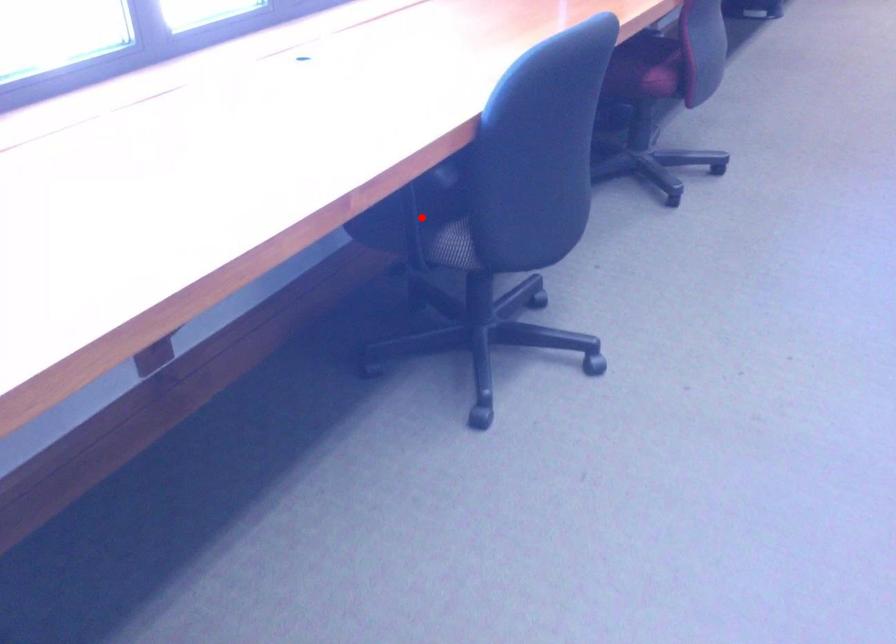
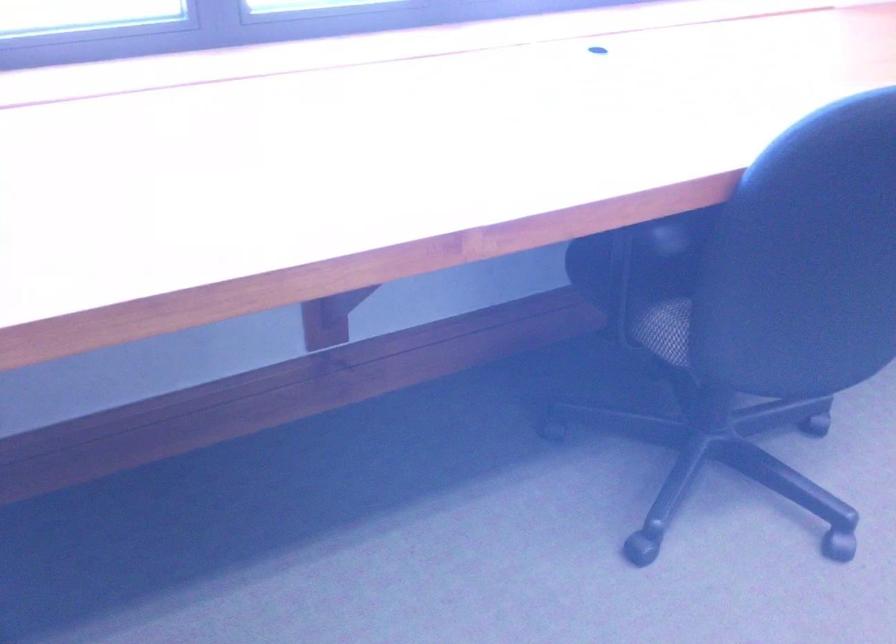
Question: I am providing you with two images of the same scene from different viewpoints. Image1 has a red point marked. In image2, the corresponding 3D location appears at what relative position? Reply with the corresponding letter.

Choices:
 (A) Closer
 (B) Farther

Answer: (A)